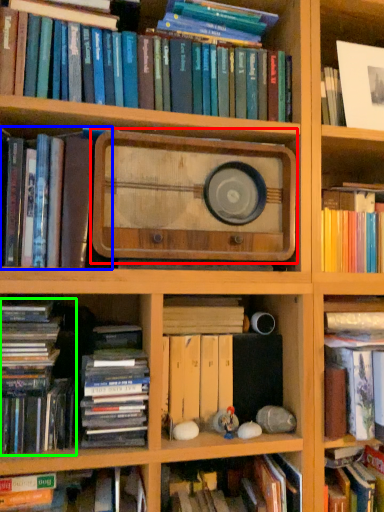
Question: Which object is the farthest from paperback book (highlighted by a red box)? Choose among these: book (highlighted by a blue box) or book (highlighted by a green box).

Choices:
 (A) book
 (B) book

Answer: (B)